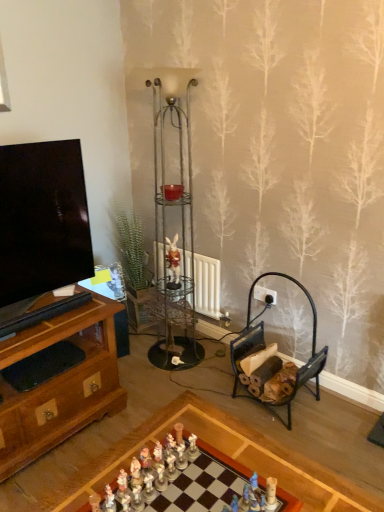
Question: Considering the relative sizes of matte brown figurine at center and white porcelain figurines at center, placed as the 1th toy when sorted from back to front, in the image provided, is matte brown figurine at center bigger than white porcelain figurines at center, placed as the 1th toy when sorted from back to front,?

Choices:
 (A) no
 (B) yes

Answer: (B)

Question: Does matte brown figurine at center lie behind white porcelain figurines at center, placed as the 1th toy when sorted from back to front?

Choices:
 (A) yes
 (B) no

Answer: (A)

Question: Is white porcelain figurines at center, which ranks as the second toy in left-to-right order, surrounded by matte brown figurine at center?

Choices:
 (A) yes
 (B) no

Answer: (B)

Question: Can you confirm if matte brown figurine at center is shorter than white porcelain figurines at center, positioned as the second toy in right-to-left order?

Choices:
 (A) yes
 (B) no

Answer: (B)

Question: Is matte brown figurine at center smaller than white porcelain figurines at center, the third toy viewed from the front?

Choices:
 (A) no
 (B) yes

Answer: (A)

Question: From a real-world perspective, is matte glass candle holder at center physically located above or below matte brown figurine at center?

Choices:
 (A) below
 (B) above

Answer: (B)

Question: From their relative heights in the image, would you say matte glass candle holder at center is taller or shorter than matte brown figurine at center?

Choices:
 (A) short
 (B) tall

Answer: (A)

Question: In the image, is matte glass candle holder at center positioned in front of or behind matte brown figurine at center?

Choices:
 (A) front
 (B) behind

Answer: (A)

Question: In terms of width, does matte glass candle holder at center look wider or thinner when compared to matte brown figurine at center?

Choices:
 (A) thin
 (B) wide

Answer: (B)

Question: In terms of width, does white porcelain figurines at center, positioned as the second toy in right-to-left order, look wider or thinner when compared to matte glass candle holder at center?

Choices:
 (A) thin
 (B) wide

Answer: (A)

Question: Which is correct: white porcelain figurines at center, positioned as the second toy in right-to-left order, is inside matte glass candle holder at center, or outside of it?

Choices:
 (A) inside
 (B) outside

Answer: (B)

Question: From a real-world perspective, is white porcelain figurines at center, positioned as the second toy in right-to-left order, physically located above or below matte glass candle holder at center?

Choices:
 (A) above
 (B) below

Answer: (B)

Question: Based on their positions, is white porcelain figurines at center, positioned as the second toy in right-to-left order, located to the left or right of matte glass candle holder at center?

Choices:
 (A) right
 (B) left

Answer: (A)

Question: Is white plastic power outlet at center-right in front of or behind matte brown figurine at center in the image?

Choices:
 (A) behind
 (B) front

Answer: (A)

Question: Considering the positions of white plastic power outlet at center-right and matte brown figurine at center in the image, is white plastic power outlet at center-right bigger or smaller than matte brown figurine at center?

Choices:
 (A) big
 (B) small

Answer: (B)